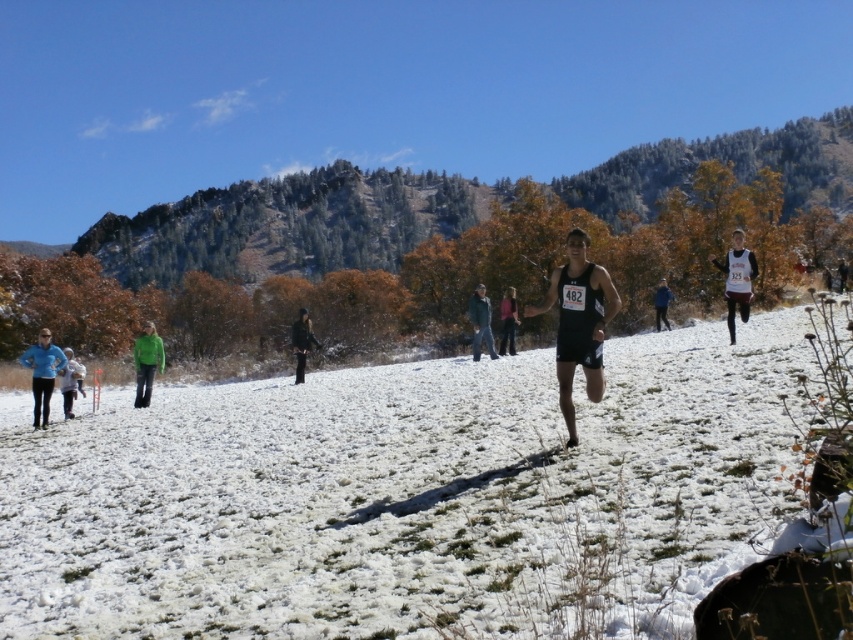
You are a participant in the race and you see the white fluffy snow at center and the green fabric pants at lower left. Which object is located above the other?

The white fluffy snow at center is positioned over green fabric pants at lower left.

You are a photographer trying to capture both the blue fleece jacket at lower left and the green wool jacket at center in a single shot. Given their positions, which jacket will appear larger in the photo?

The blue fleece jacket at lower left will appear larger in the photo because it is much taller than the green wool jacket at center.